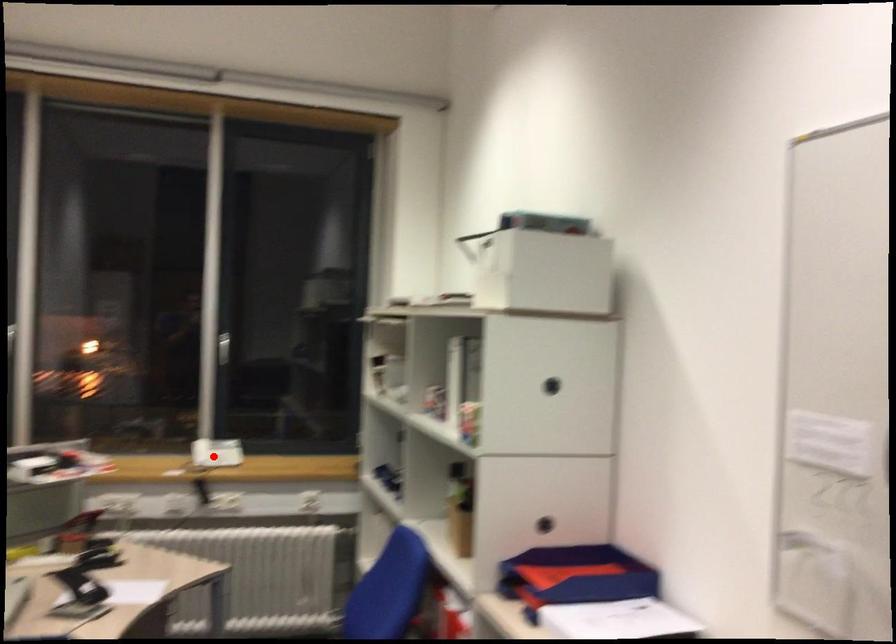
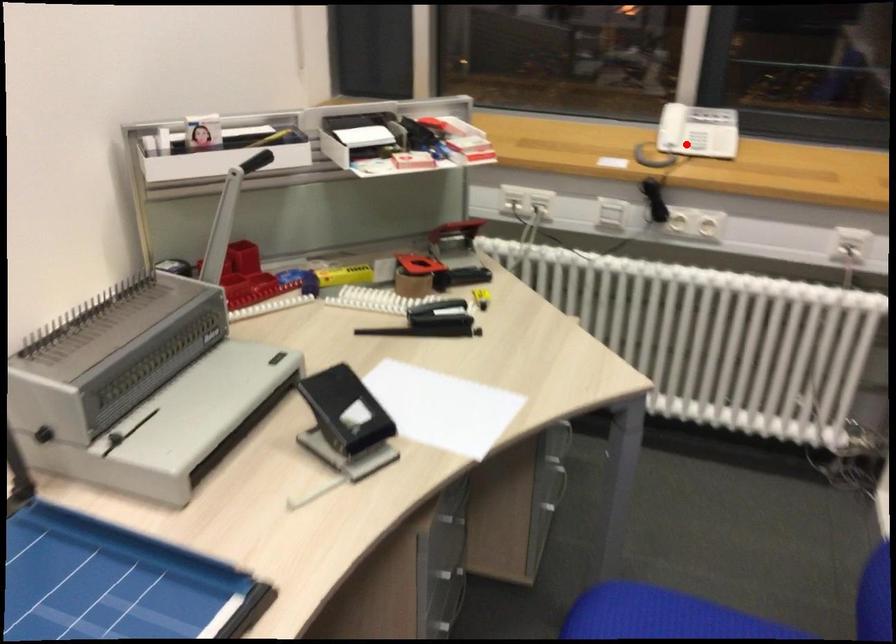
I am providing you with two images of the same scene from different viewpoints. A red point is marked on the first image and another point is marked on the second image. Is the marked point in image1 the same physical position as the marked point in image2?

Yes